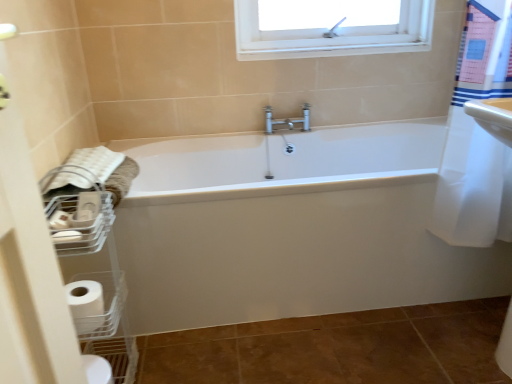
Question: In the image, is white matte toilet paper at lower left positioned in front of or behind white plastic basket at lower left?

Choices:
 (A) front
 (B) behind

Answer: (B)

Question: Is point (96, 294) closer or farther from the camera than point (74, 231)?

Choices:
 (A) closer
 (B) farther

Answer: (B)

Question: Estimate the real-world distances between objects in this image. Which object is closer to the white glossy bathtub at center?

Choices:
 (A) white soft towel at left
 (B) white matte toilet paper at lower left
 (C) brown matte ceramic tile at lower center
 (D) white plastic basket at lower left

Answer: (C)

Question: Which of these objects is positioned farthest from the brown matte ceramic tile at lower center?

Choices:
 (A) white matte toilet paper at lower left
 (B) white soft towel at left
 (C) white plastic basket at lower left
 (D) white glossy bathtub at center

Answer: (B)